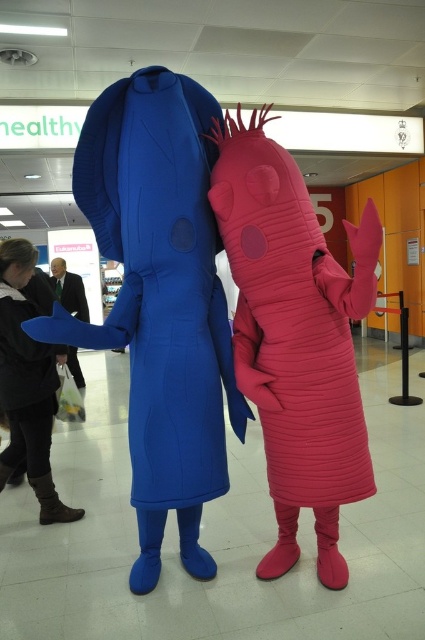
You are a photographer setting up for a photoshoot. You need to position a matte blue costume at center and brown leather boots at lower left so that they are exactly 30 inches apart. Based on the scene, will your current setup meet the requirement?

The distance between the matte blue costume at center and brown leather boots at lower left is 30.40 inches, which is slightly more than 30 inches. To meet the requirement, you should move them closer by 0.40 inches.

You are a photographer standing at a certain distance from the rubber pink worm at center. You want to capture a closeup shot of the costume details. Based on the given information, is the current distance sufficient for a clear closeup without using a zoom lens?

The distance between the rubber pink worm at center and the camera is 1.39 meters. To capture a clear closeup without a zoom lens, you would need to be closer than this distance. Therefore, you should move closer to the rubber pink worm at center to ensure the details are sharp and in focus.

You are standing in front of the image and want to locate the brown leather boots at lower left. According to the coordinates provided, where exactly would you look on the image to find them?

The brown leather boots at lower left are located at point coordinates of 0.602 on the x axis and 0.066 on the y axis.